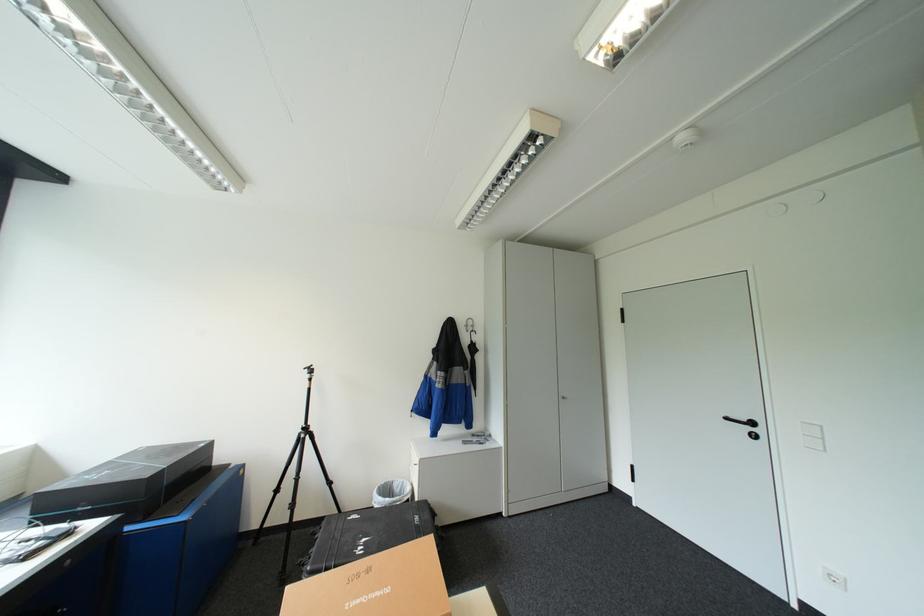
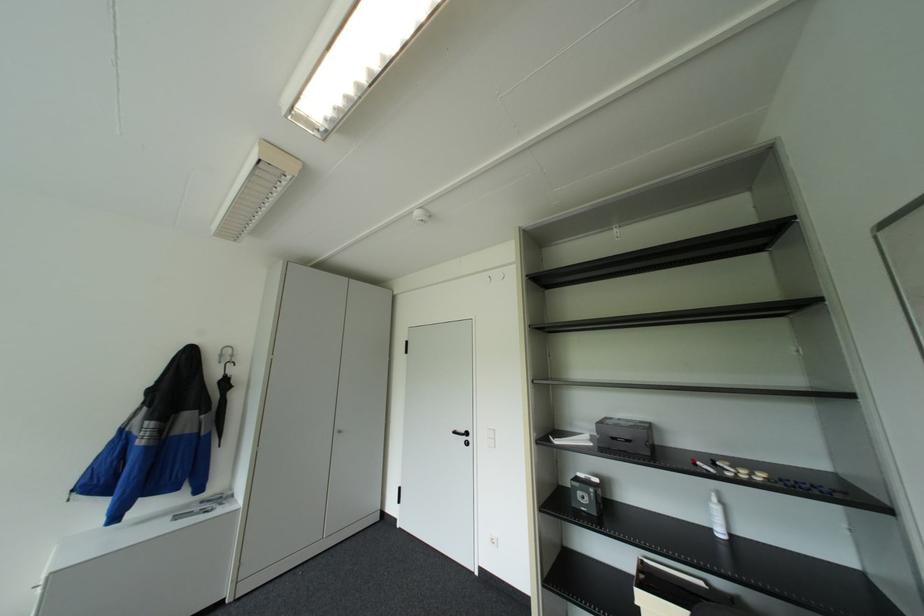
The point at (735,416) is marked in the first image. Where is the corresponding point in the second image?

(463, 431)